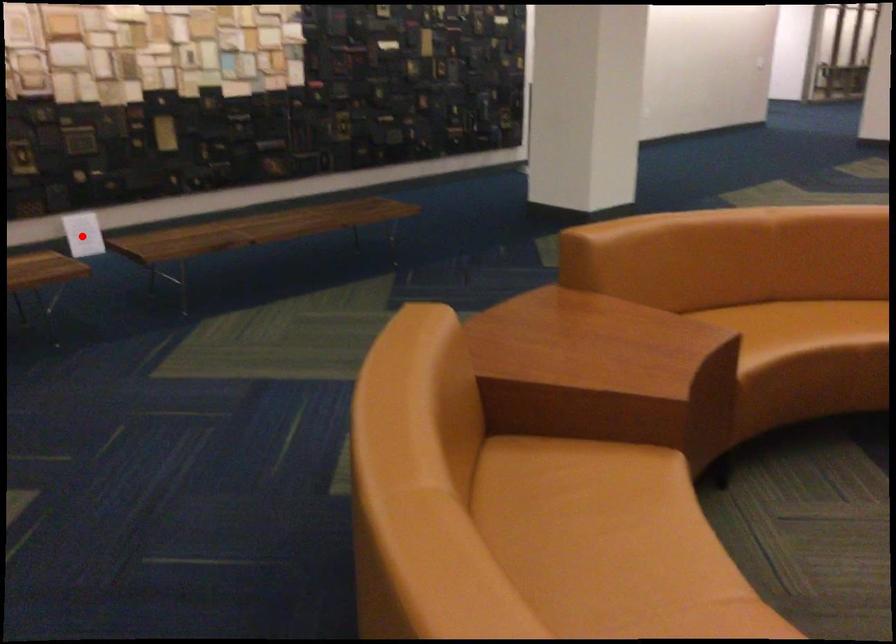
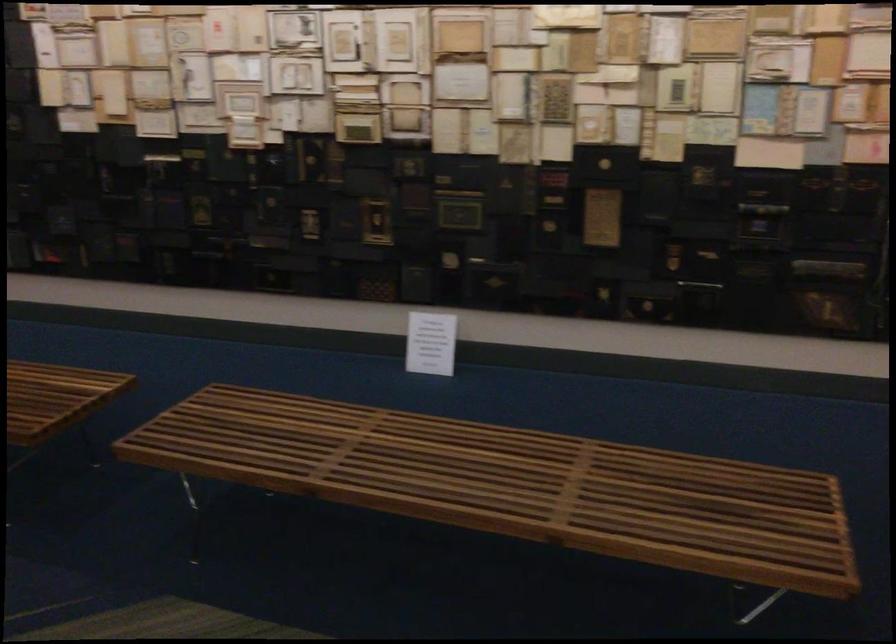
The point at the highlighted location is marked in the first image. Where is the corresponding point in the second image?

(431, 343)